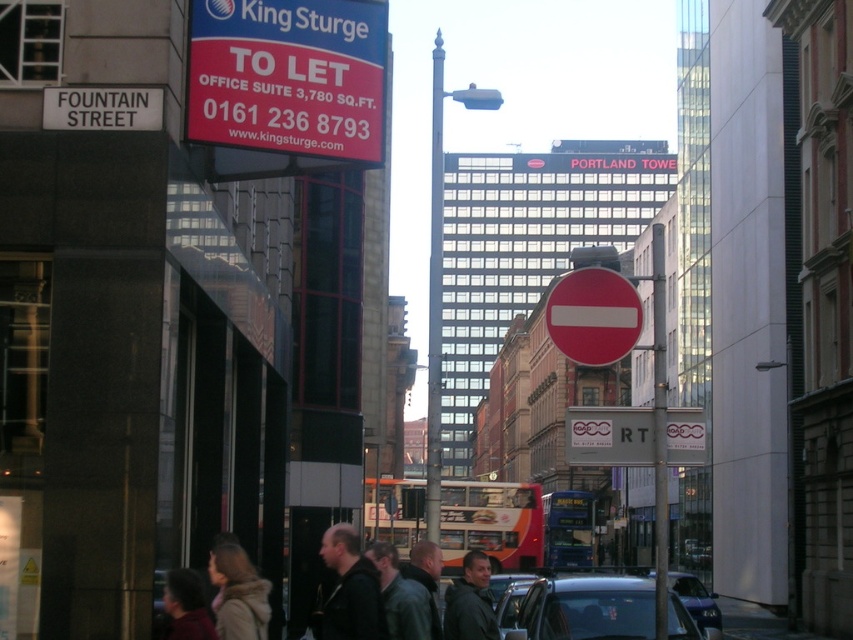
Question: Among these objects, which one is nearest to the camera?

Choices:
 (A) matte plastic sign at upper left
 (B) leather jacket at center

Answer: (B)

Question: Can you confirm if white plastic sign at center is positioned above leather jacket at center?

Choices:
 (A) no
 (B) yes

Answer: (B)

Question: Based on their relative distances, which object is farther from the metallic silver car at center?

Choices:
 (A) white plastic sign at center
 (B) dark gray jacket at center
 (C) metallic pole at center-right

Answer: (B)

Question: Can you confirm if light brown hair at lower center is positioned to the right of dark green jacket at center?

Choices:
 (A) no
 (B) yes

Answer: (A)

Question: Can you confirm if white plastic sign at center is positioned below dark gray jacket at center?

Choices:
 (A) no
 (B) yes

Answer: (A)

Question: Which of the following is the closest to the observer?

Choices:
 (A) (259, 620)
 (B) (463, 604)
 (C) (662, 412)
 (D) (451, 541)

Answer: (A)